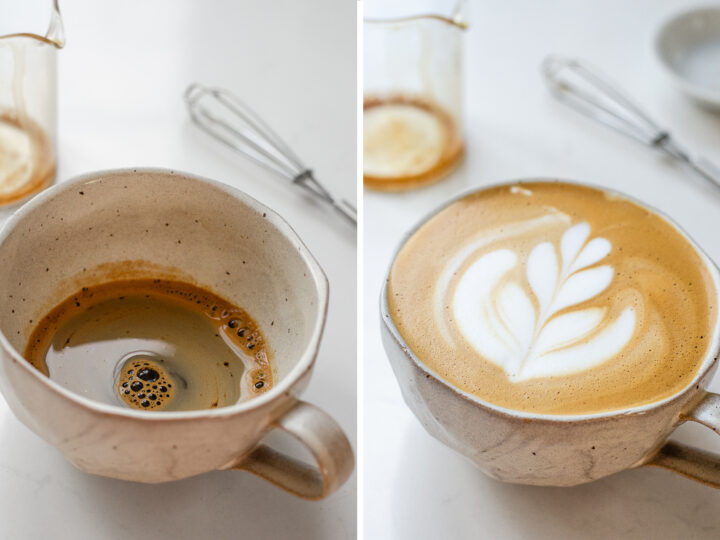
Identify the location of liquid at bottom of coffee mug. (124, 314).